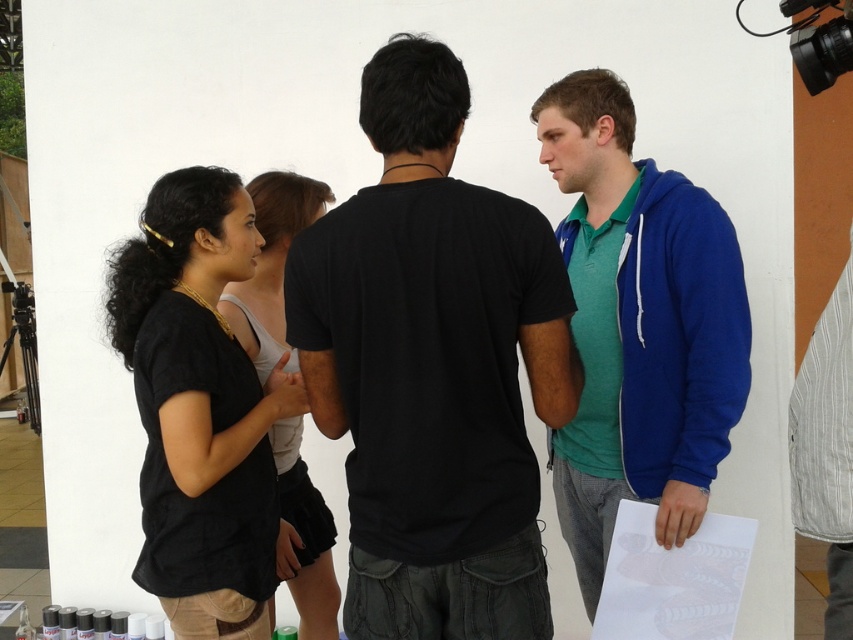
You are organizing a charity event and need to decide which of the two items, the blue fleece jacket at right or the black linen shirt at center, would be more suitable for a large group photo where visibility is key. Based on their sizes, which item would make the person wearing it more noticeable?

The blue fleece jacket at right is bigger than the black linen shirt at center, so the person wearing the blue fleece jacket at right would be more noticeable in the group photo.